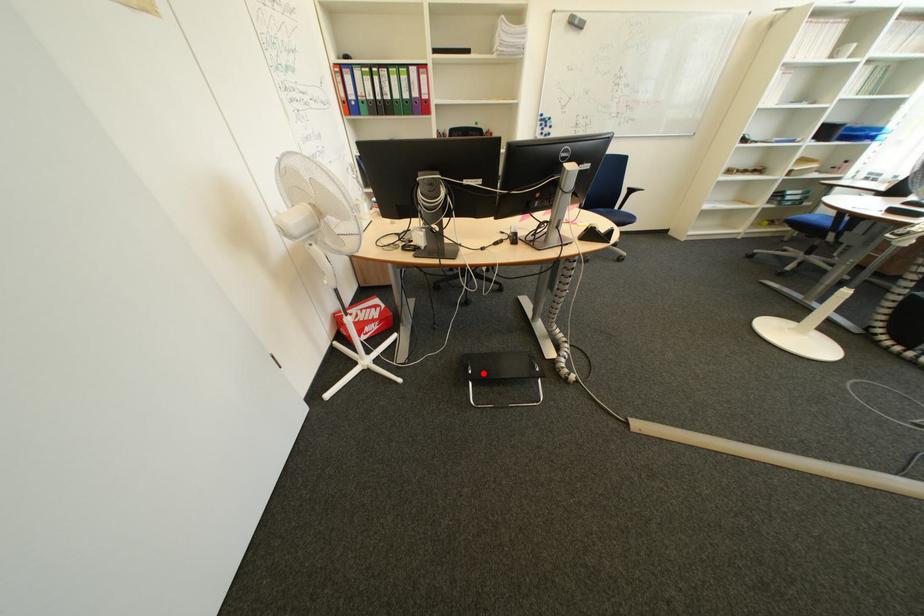
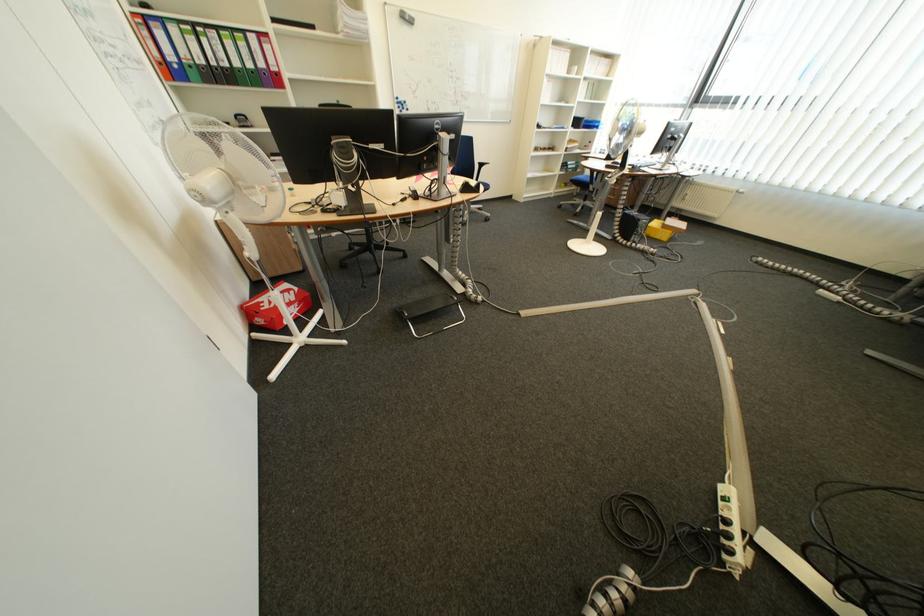
Find the pixel in the second image that matches the highlighted location in the first image.

(419, 315)